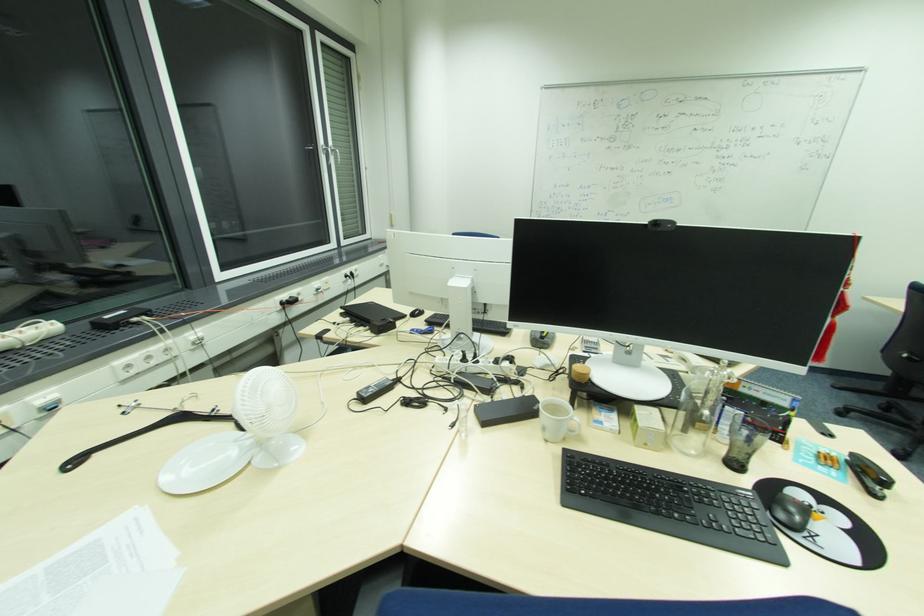
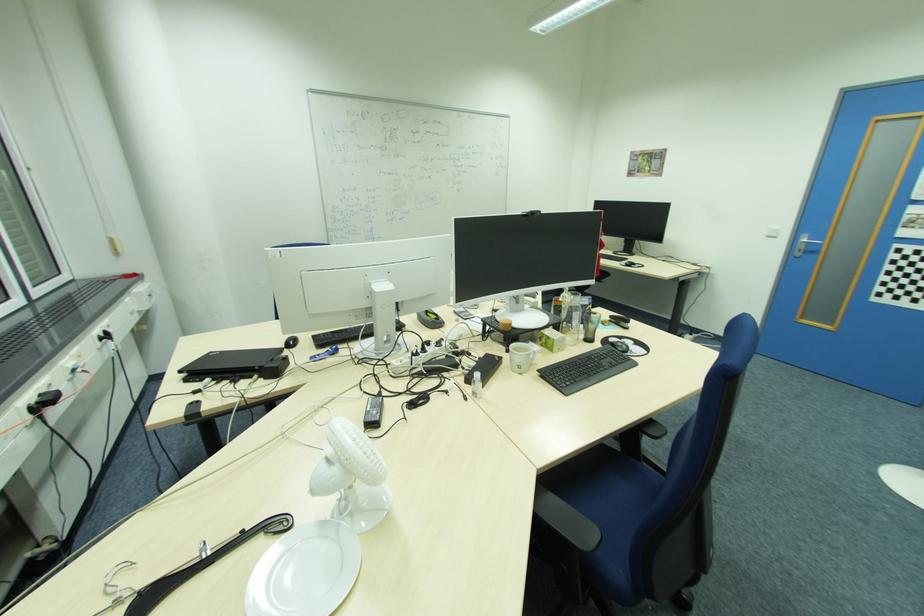
Question: Based on the continuous images, in which direction is the camera rotating? Reply with the corresponding letter.

Choices:
 (A) Left
 (B) Right
 (C) Up
 (D) Down

Answer: (B)